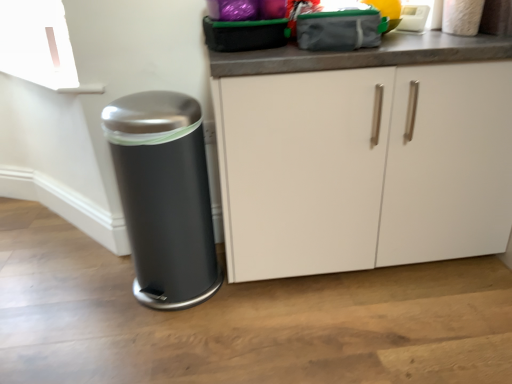
Find the location of a particular element. Image resolution: width=512 pixels, height=384 pixels. space that is in front of satin black trash can at lower left is located at coordinates (167, 335).